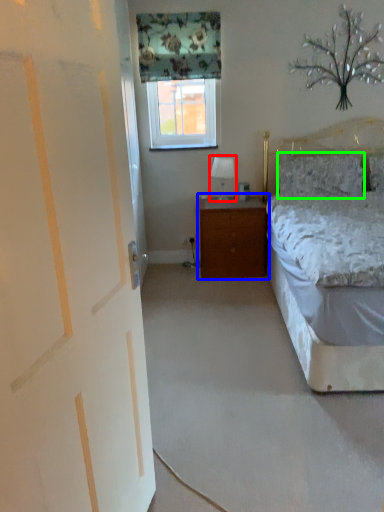
Question: Estimate the real-world distances between objects in this image. Which object is closer to table lamp (highlighted by a red box), nightstand (highlighted by a blue box) or pillow (highlighted by a green box)?

Choices:
 (A) nightstand
 (B) pillow

Answer: (A)